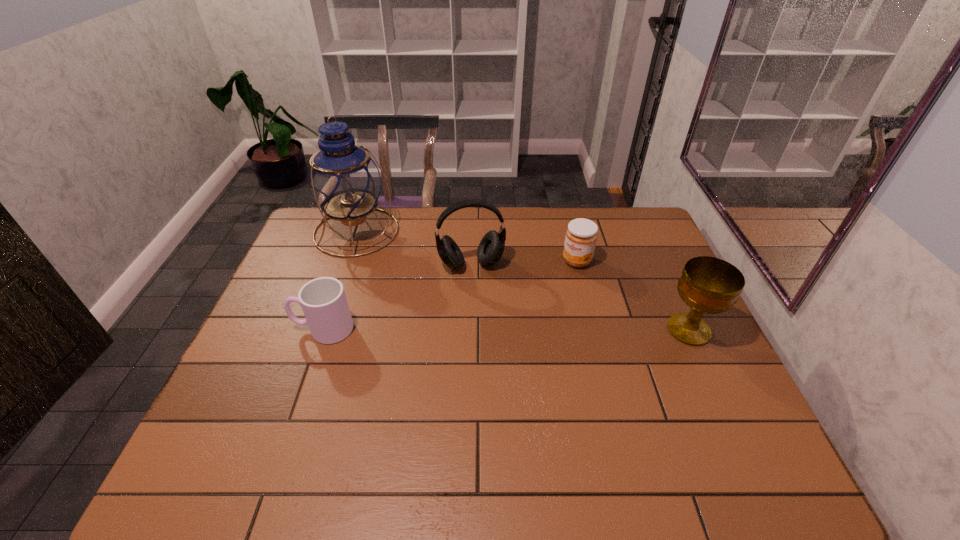
Locate an element on the screen. The height and width of the screenshot is (540, 960). free spot at the far edge of the desktop is located at coordinates (540, 247).

Identify the location of vacant point at the near edge. (659, 415).

In the image, there is a desktop. Where is `vacant space at the left edge`? vacant space at the left edge is located at coordinates click(319, 276).

Locate an element on the screen. This screenshot has height=540, width=960. free point at the right edge is located at coordinates (666, 321).

In the image, there is a desktop. Where is `free region at the far left corner`? The width and height of the screenshot is (960, 540). free region at the far left corner is located at coordinates (334, 244).

At what (x,y) coordinates should I click in order to perform the action: click on free space at the near left corner of the desktop. Please return your answer as a coordinate pair (x, y). Looking at the image, I should click on (265, 422).

The height and width of the screenshot is (540, 960). Identify the location of free spot at the far right corner of the desktop. (643, 224).

I want to click on empty space that is in between the tallest object and the headset, so click(414, 247).

Locate an element on the screen. This screenshot has height=540, width=960. free point between the lantern and the jam is located at coordinates (467, 246).

The width and height of the screenshot is (960, 540). What are the coordinates of `vacant area that lies between the rightmost object and the fourth object from left to right` in the screenshot? It's located at (x=633, y=295).